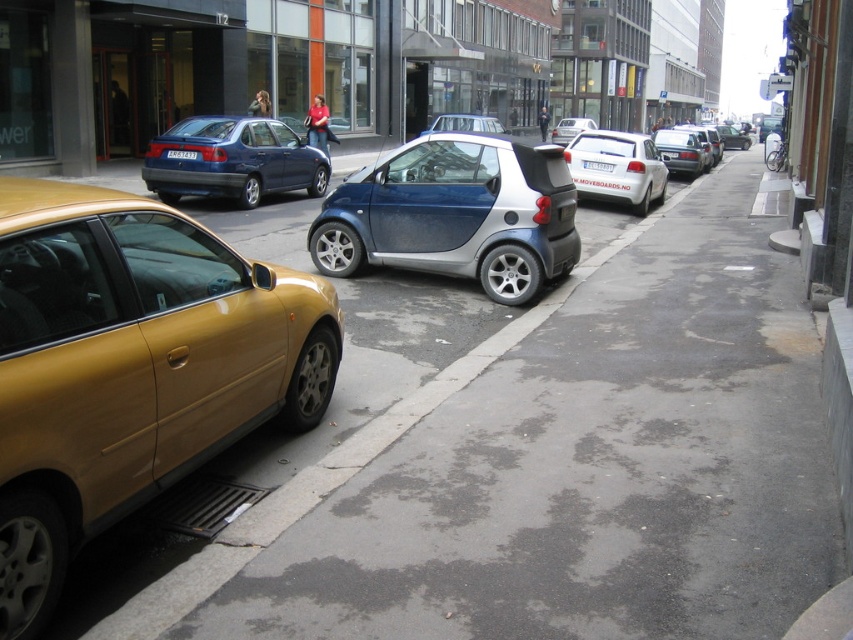
Which is below, gold metallic sedan at lower left or metallic silver sedan at center?

gold metallic sedan at lower left is lower down.

Between point (216, 433) and point (677, 131), which one is positioned in front?

Positioned in front is point (216, 433).

Where is `gold metallic sedan at lower left`? This screenshot has width=853, height=640. gold metallic sedan at lower left is located at coordinates (131, 368).

Which is below, matte blue sedan at center or white plastic license plate at center?

matte blue sedan at center is lower down.

From the picture: Who is more distant from viewer, (199, 132) or (595, 163)?

Point (595, 163)

Locate an element on the screen. matte blue sedan at center is located at coordinates (233, 161).

This screenshot has width=853, height=640. Describe the element at coordinates (456, 214) in the screenshot. I see `metallic blue car at center` at that location.

You are a GUI agent. You are given a task and a screenshot of the screen. Output one action in this format:
    pyautogui.click(x=<x>, y=<y>)
    Task: Click on the metallic blue car at center
    The image size is (853, 640).
    Given the screenshot: What is the action you would take?
    pyautogui.click(x=456, y=214)

Locate an element on the screen. The width and height of the screenshot is (853, 640). metallic blue car at center is located at coordinates (456, 214).